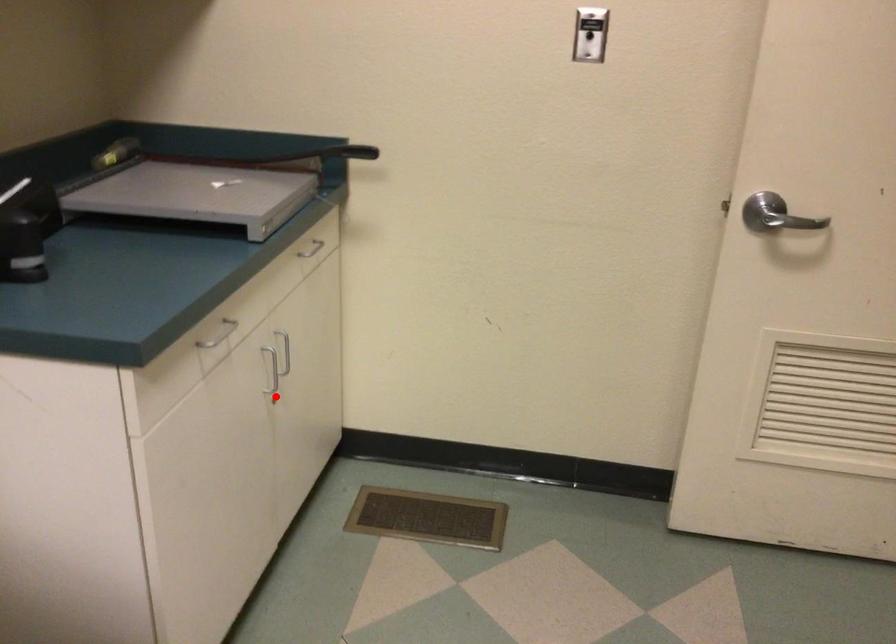
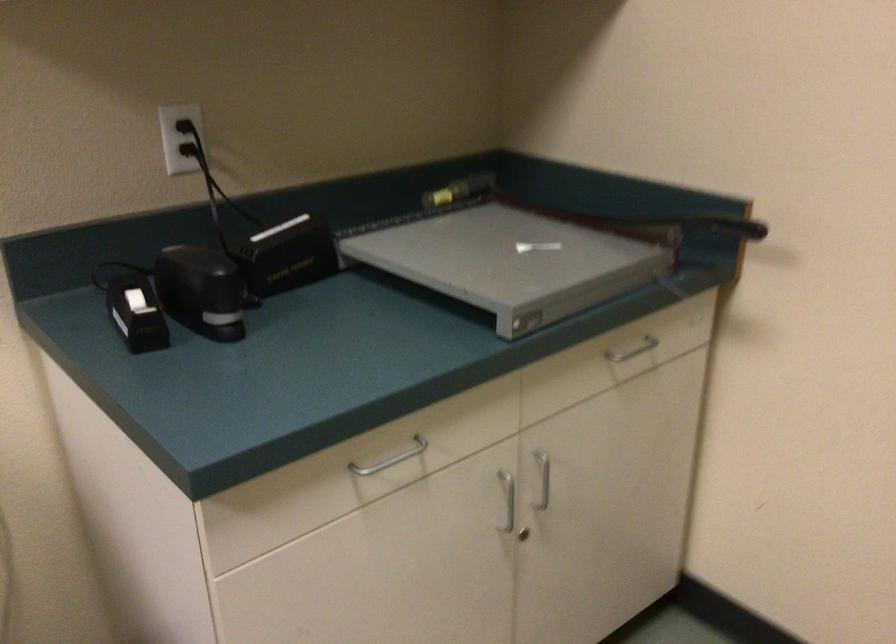
Question: I am providing you with two images of the same scene from different viewpoints. Image1 has a red point marked. In image2, the corresponding 3D location appears at what relative position? Reply with the corresponding letter.

Choices:
 (A) Closer
 (B) Farther

Answer: (A)